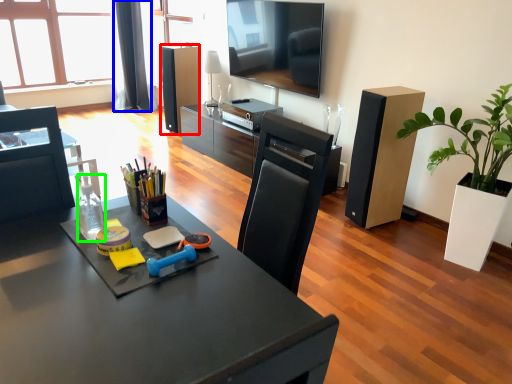
Question: Estimate the real-world distances between objects in this image. Which object is closer to speaker (highlighted by a red box), curtain (highlighted by a blue box) or bottle (highlighted by a green box)?

Choices:
 (A) curtain
 (B) bottle

Answer: (A)